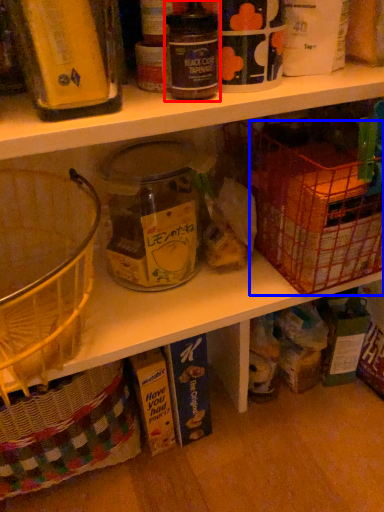
Question: Which point is further to the camera, bottle (highlighted by a red box) or basket (highlighted by a blue box)?

Choices:
 (A) bottle
 (B) basket

Answer: (B)